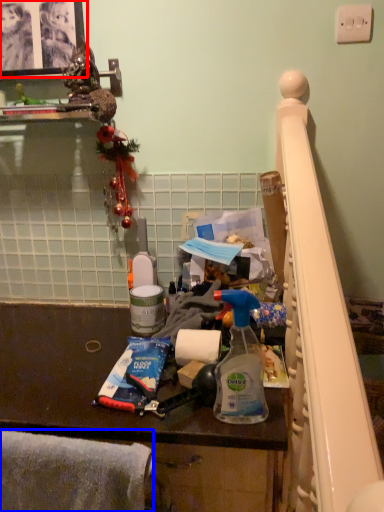
Question: Which object appears closest to the camera in this image, picture frame (highlighted by a red box) or blanket (highlighted by a blue box)?

Choices:
 (A) picture frame
 (B) blanket

Answer: (B)